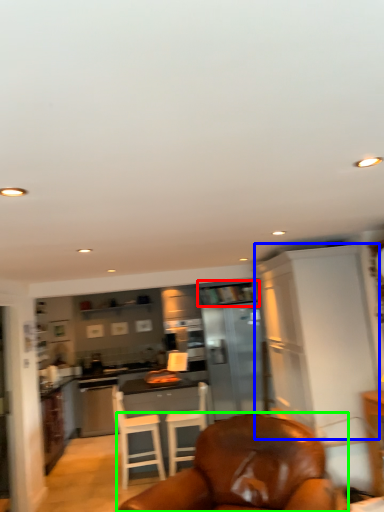
Question: Which object is positioned farthest from shelf (highlighted by a red box)? Select from cabinetry (highlighted by a blue box) and chair (highlighted by a green box).

Choices:
 (A) cabinetry
 (B) chair

Answer: (B)